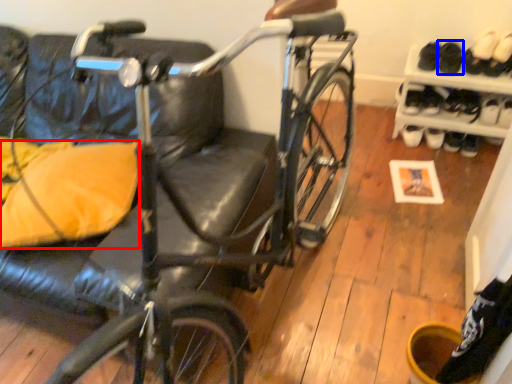
Question: Among these objects, which one is farthest to the camera, pillow (highlighted by a red box) or footwear (highlighted by a blue box)?

Choices:
 (A) pillow
 (B) footwear

Answer: (B)